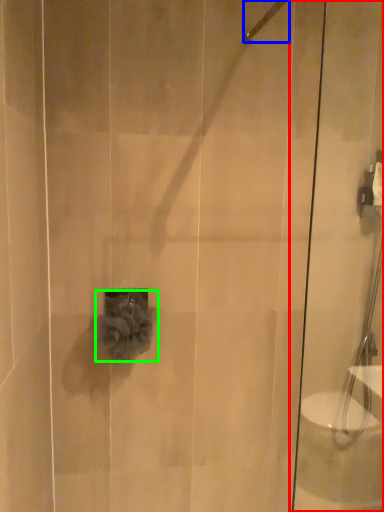
Question: Based on their relative distances, which object is nearer to shower door (highlighted by a red box)? Choose from shower (highlighted by a blue box) and flower (highlighted by a green box).

Choices:
 (A) shower
 (B) flower

Answer: (B)